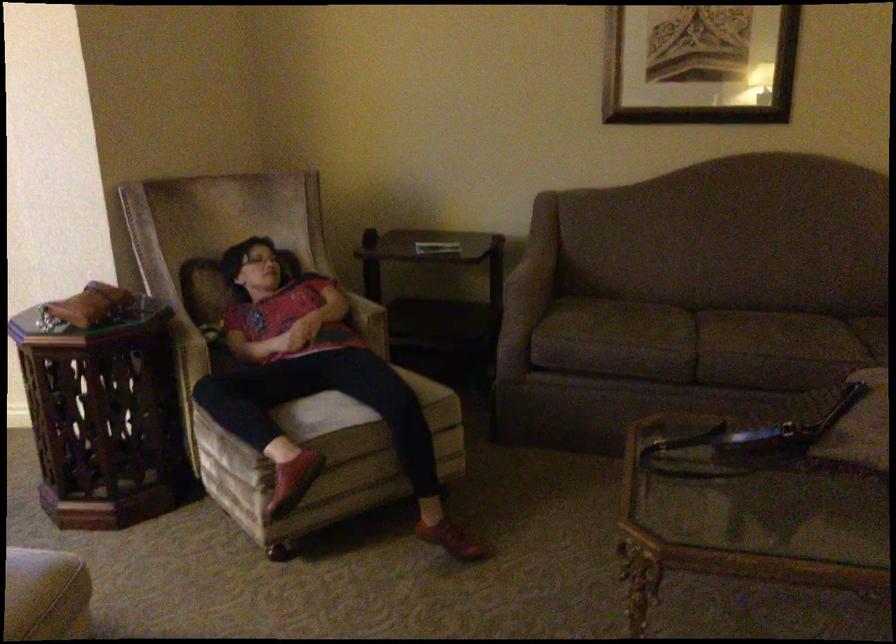
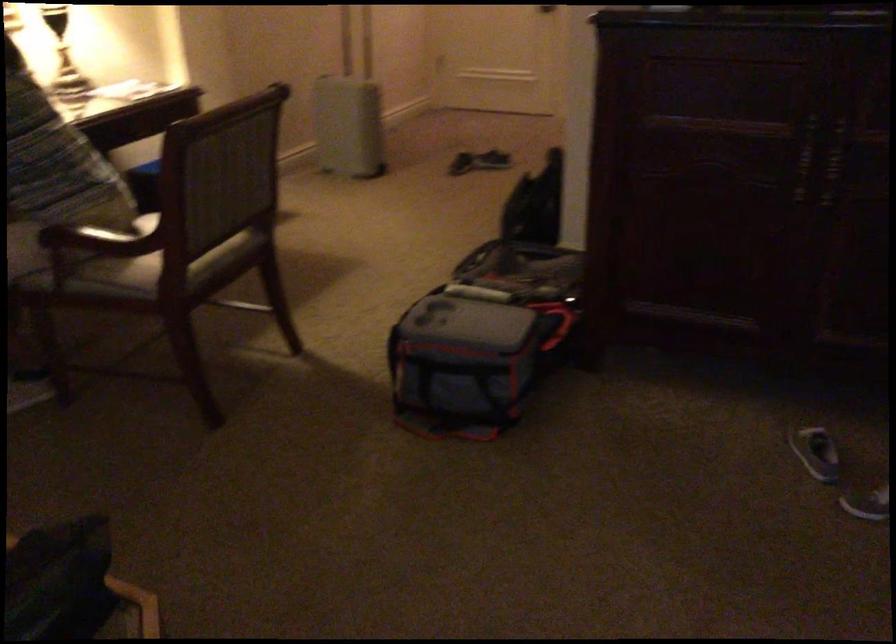
Based on the continuous images, in which direction is the camera rotating?

The rotation direction of the camera is right-down.